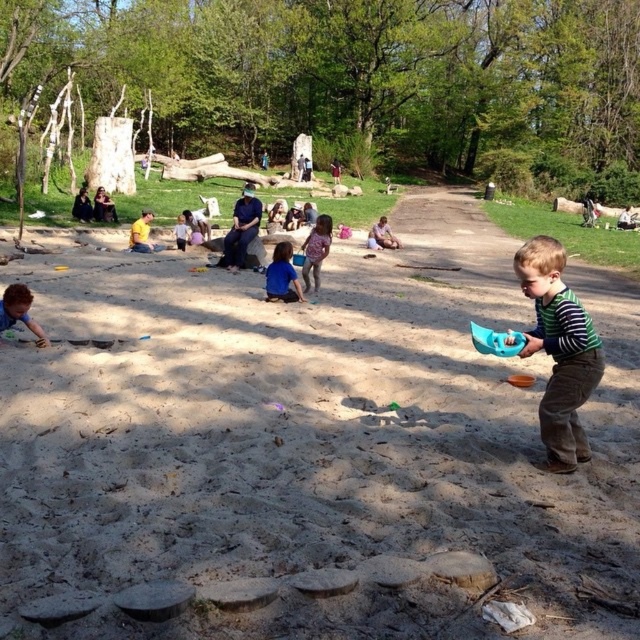
You are a parent trying to locate your child in the park. You see two children wearing shirts labeled as blue matte shirt at center and purple floral shirt at center. Which child is closer to you?

The blue matte shirt at center is closer to the viewer than the purple floral shirt at center, so the child wearing the blue matte shirt at center is closer to you.

You are standing at the point labeled point (x=145, y=244) in the park scene. You want to walk straight ahead to reach the sandbox area. Is the point labeled point (x=76, y=422) in your path?

Yes, the point labeled point (x=76, y=422) is in front of point (x=145, y=244), so it is in your path as you walk straight ahead toward the sandbox area.